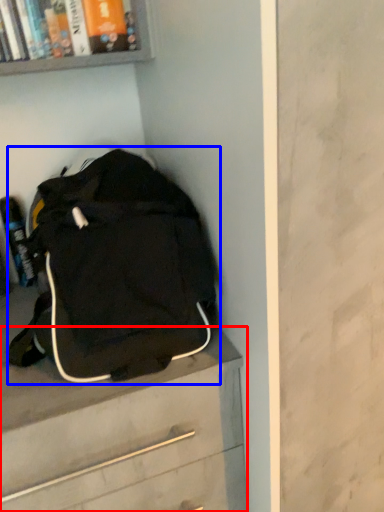
Question: Among these objects, which one is farthest to the camera, chest of drawers (highlighted by a red box) or backpack (highlighted by a blue box)?

Choices:
 (A) chest of drawers
 (B) backpack

Answer: (A)